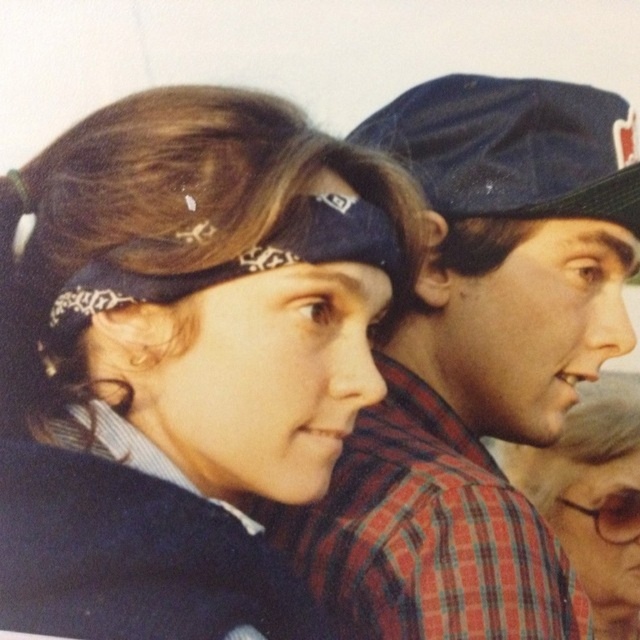
Locate an element on the screen. This screenshot has width=640, height=640. matte black bandana at center is located at coordinates (182, 358).

Who is more distant from viewer, (116, 344) or (596, 508)?

Point (596, 508)

Which is in front, point (12, 564) or point (520, 486)?

Point (12, 564) is in front.

Locate an element on the screen. The width and height of the screenshot is (640, 640). matte black bandana at center is located at coordinates (182, 358).

Can you confirm if plaid fabric shirt at center is taller than matte black headband at upper center?

→ Indeed, plaid fabric shirt at center has a greater height compared to matte black headband at upper center.

This screenshot has width=640, height=640. In order to click on plaid fabric shirt at center in this screenshot , I will do `click(477, 364)`.

Can you confirm if matte black bandana at center is positioned to the left of plaid fabric shirt at center?

Yes, matte black bandana at center is to the left of plaid fabric shirt at center.

Who is lower down, matte black bandana at center or plaid fabric shirt at center?

plaid fabric shirt at center is lower down.

This screenshot has height=640, width=640. Identify the location of matte black bandana at center. (182, 358).